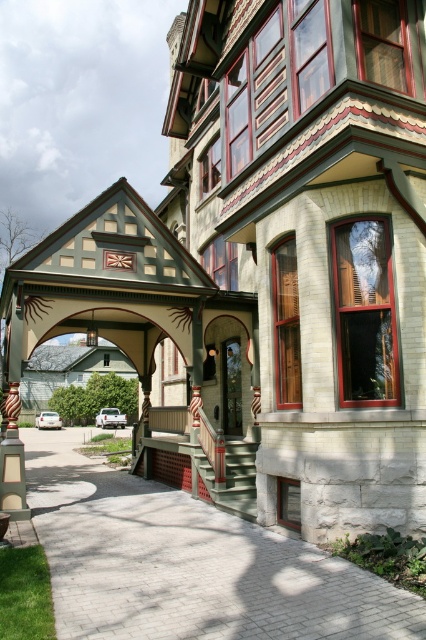
Question: Can you confirm if gray brick driveway at lower left is positioned below green painted wood porch at lower center?

Choices:
 (A) yes
 (B) no

Answer: (A)

Question: Which point is farther from the camera taking this photo?

Choices:
 (A) (406, 605)
 (B) (233, 456)

Answer: (B)

Question: Is gray brick driveway at lower left thinner than green painted wood porch at lower center?

Choices:
 (A) yes
 (B) no

Answer: (B)

Question: Which point appears farthest from the camera in this image?

Choices:
 (A) (175, 429)
 (B) (193, 586)

Answer: (A)

Question: Is gray brick driveway at lower left smaller than green painted wood porch at lower center?

Choices:
 (A) yes
 (B) no

Answer: (B)

Question: Which point is closer to the camera?

Choices:
 (A) gray brick driveway at lower left
 (B) green painted wood porch at lower center

Answer: (A)